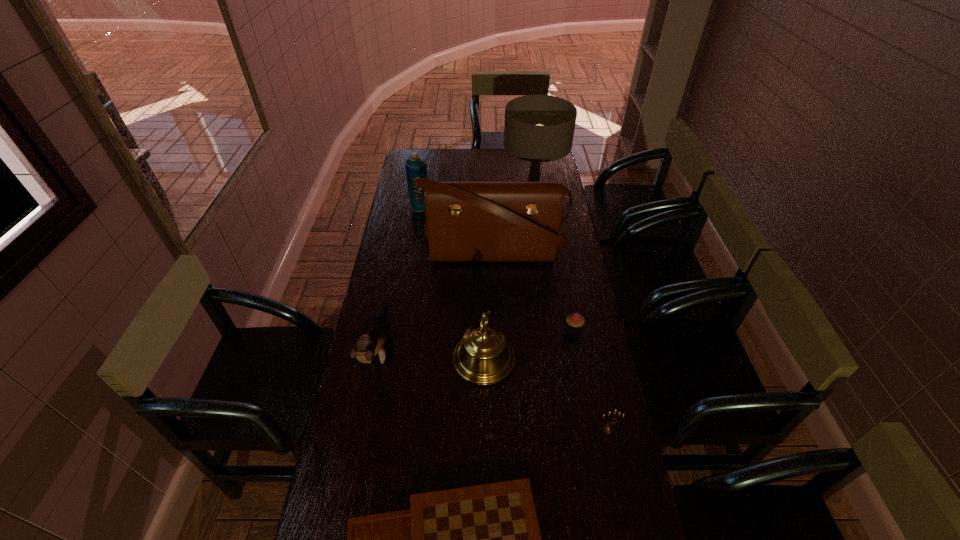
You are a GUI agent. You are given a task and a screenshot of the screen. Output one action in this format:
    pyautogui.click(x=<x>, y=<y>)
    Task: Click on the satchel that is at the right edge
    
    Given the screenshot: What is the action you would take?
    pyautogui.click(x=465, y=221)

Where is `candelabrum present at the right edge`? The image size is (960, 540). candelabrum present at the right edge is located at coordinates (607, 427).

Where is `cupcake that is at the right edge`? cupcake that is at the right edge is located at coordinates (574, 321).

The width and height of the screenshot is (960, 540). In order to click on vacant area at the far edge in this screenshot , I will do `click(437, 171)`.

Locate an element on the screen. free region at the left edge is located at coordinates (419, 233).

Where is `free point at the right edge`? free point at the right edge is located at coordinates (589, 393).

Image resolution: width=960 pixels, height=540 pixels. Find the location of `vacant space that's between the lampshade and the cat`. vacant space that's between the lampshade and the cat is located at coordinates (456, 271).

Where is `vacant space that's between the cupcake and the aerosol can`? The height and width of the screenshot is (540, 960). vacant space that's between the cupcake and the aerosol can is located at coordinates (497, 267).

This screenshot has width=960, height=540. Identify the location of free space between the sixth nearest object and the cat. (436, 301).

Locate an element on the screen. vacant point located between the candelabrum and the fourth tallest object is located at coordinates (546, 394).